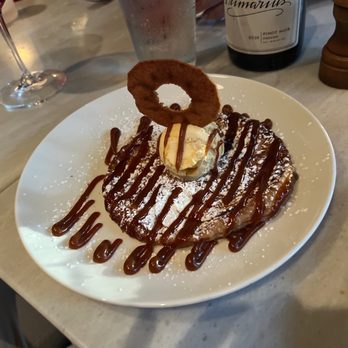
Locate an element on the screen. The width and height of the screenshot is (348, 348). the bottom of wineglass is located at coordinates (35, 96).